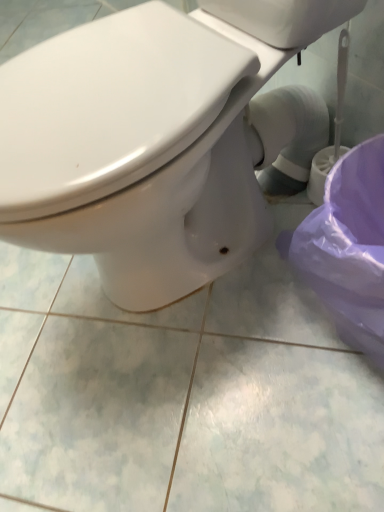
Question: Would you say purple plastic potty at lower right is to the left or to the right of white glossy toilet at center in the picture?

Choices:
 (A) left
 (B) right

Answer: (B)

Question: In the image, is purple plastic potty at lower right positioned in front of or behind white glossy toilet at center?

Choices:
 (A) front
 (B) behind

Answer: (B)

Question: From their relative heights in the image, would you say purple plastic potty at lower right is taller or shorter than white glossy toilet at center?

Choices:
 (A) tall
 (B) short

Answer: (B)

Question: Would you say white glossy toilet at center is to the left or to the right of purple plastic potty at lower right in the picture?

Choices:
 (A) left
 (B) right

Answer: (A)

Question: In terms of height, does white glossy toilet at center look taller or shorter compared to purple plastic potty at lower right?

Choices:
 (A) tall
 (B) short

Answer: (A)

Question: From a real-world perspective, is white glossy toilet at center positioned above or below purple plastic potty at lower right?

Choices:
 (A) below
 (B) above

Answer: (B)

Question: Looking at their shapes, would you say white glossy toilet at center is wider or thinner than purple plastic potty at lower right?

Choices:
 (A) thin
 (B) wide

Answer: (B)